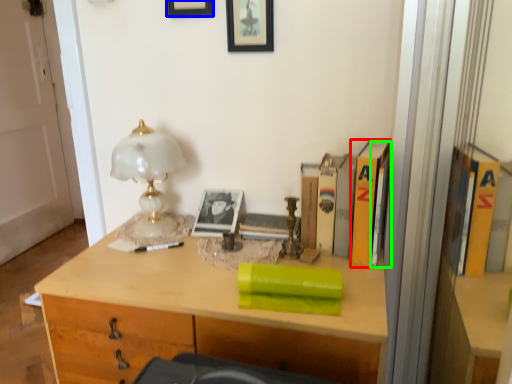
Question: Which is nearer to the paperback book (highlighted by a red box)? picture frame (highlighted by a blue box) or book (highlighted by a green box).

Choices:
 (A) picture frame
 (B) book

Answer: (B)